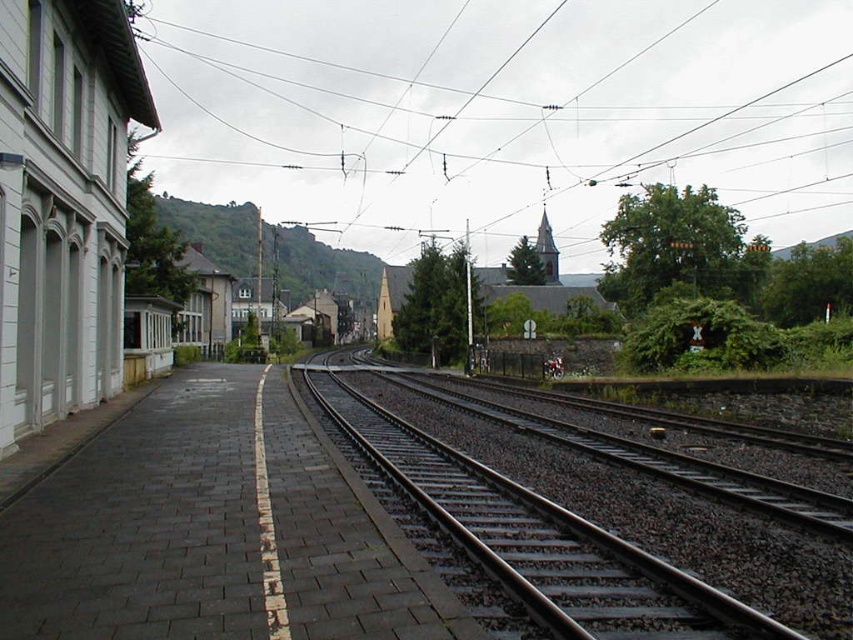
Question: Is metallic wires at upper center thinner than black metal track at center?

Choices:
 (A) no
 (B) yes

Answer: (A)

Question: Can you confirm if metallic wires at upper center is positioned to the left of black metal track at center?

Choices:
 (A) yes
 (B) no

Answer: (B)

Question: Can you confirm if metallic wires at upper center is bigger than black metal track at center?

Choices:
 (A) no
 (B) yes

Answer: (B)

Question: Which of the following is the closest to the observer?

Choices:
 (A) (538, 563)
 (B) (428, 129)

Answer: (A)